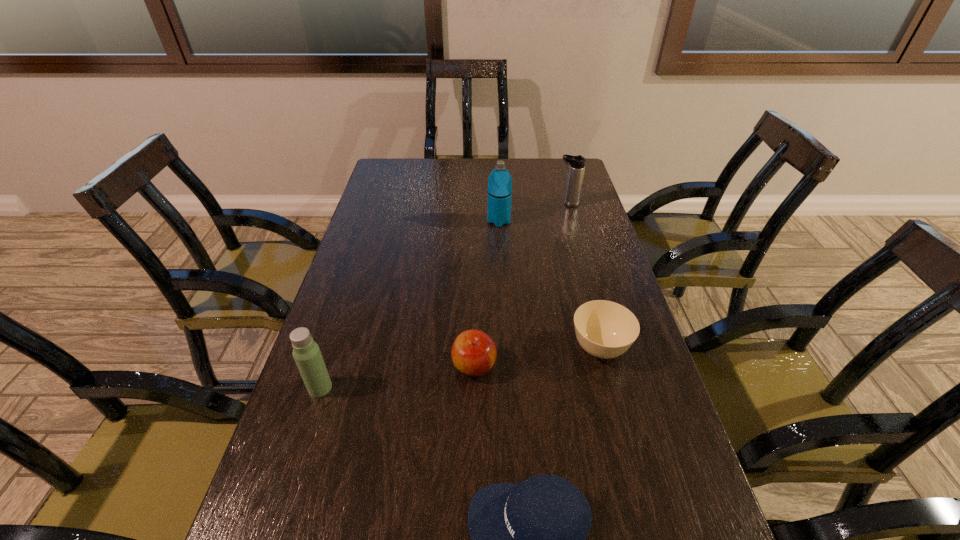
Where is `the second farthest thermos bottle`? This screenshot has width=960, height=540. the second farthest thermos bottle is located at coordinates (500, 181).

Identify the location of the tallest object. The width and height of the screenshot is (960, 540). (500, 181).

Find the location of `the farthest thermos bottle`. the farthest thermos bottle is located at coordinates (577, 163).

This screenshot has width=960, height=540. What are the coordinates of `the rightmost thermos bottle` in the screenshot? It's located at (577, 163).

You are a GUI agent. You are given a task and a screenshot of the screen. Output one action in this format:
    pyautogui.click(x=<x>, y=<y>)
    Task: Click on the leftmost thermos bottle
    The image size is (960, 540).
    Given the screenshot: What is the action you would take?
    pyautogui.click(x=306, y=352)

What are the coordinates of `the leftmost object` in the screenshot? It's located at (306, 352).

This screenshot has width=960, height=540. In order to click on apple in this screenshot , I will do `click(473, 353)`.

This screenshot has height=540, width=960. Identify the location of sugar bowl. (604, 329).

You are a GUI agent. You are given a task and a screenshot of the screen. Output one action in this format:
    pyautogui.click(x=<x>, y=<y>)
    Task: Click on the blank space located on the back of the second thermos bottle from right to left
    Image resolution: width=960 pixels, height=540 pixels.
    Given the screenshot: What is the action you would take?
    pyautogui.click(x=497, y=188)

Image resolution: width=960 pixels, height=540 pixels. I want to click on vacant space located on the handle side of the rightmost thermos bottle, so click(x=540, y=204).